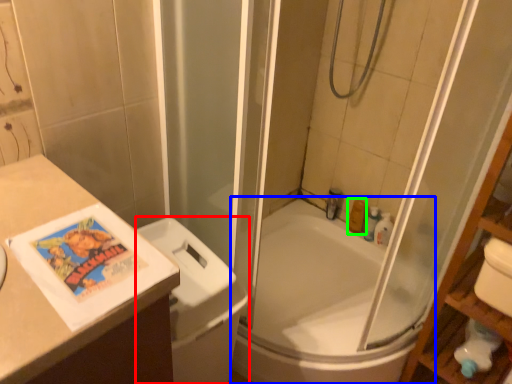
Question: Based on their relative distances, which object is nearer to toilet bowl (highlighted by a red box)? Choose from bathtub (highlighted by a blue box) and toiletry (highlighted by a green box).

Choices:
 (A) bathtub
 (B) toiletry

Answer: (A)